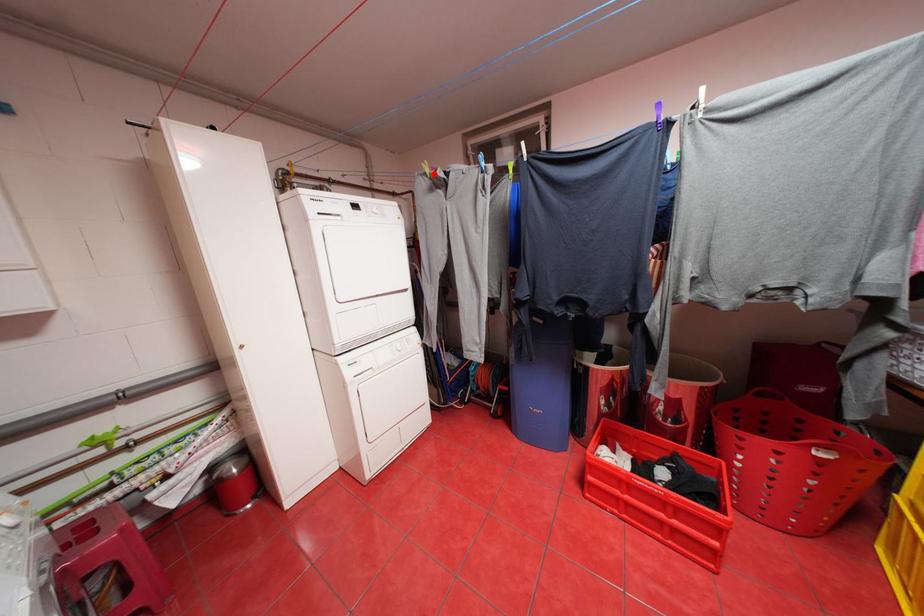
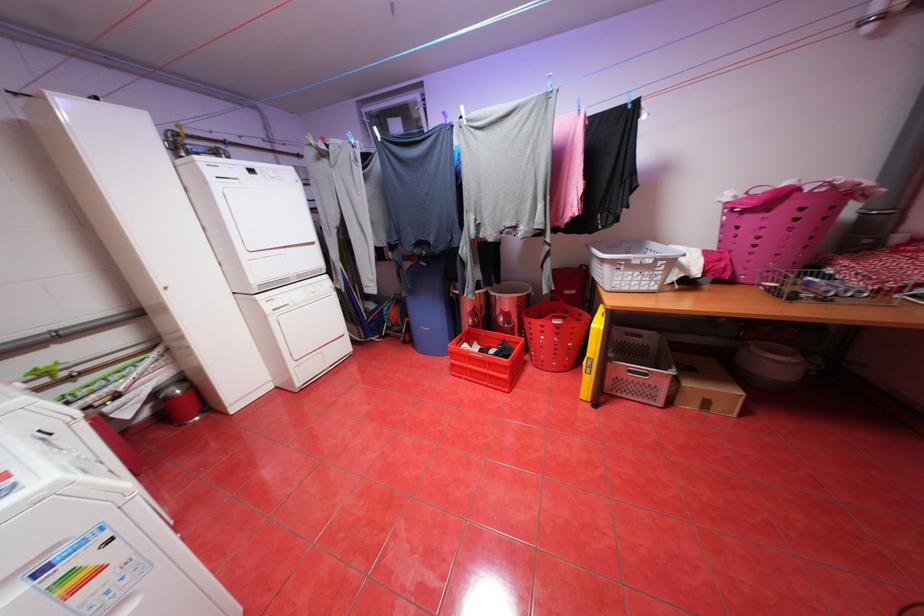
Question: I am providing you with two images of the same scene from different viewpoints. A red point is marked on the first image. At the location where the point appears in image 1, is it still visible in image 2?

Choices:
 (A) Yes
 (B) No

Answer: (A)